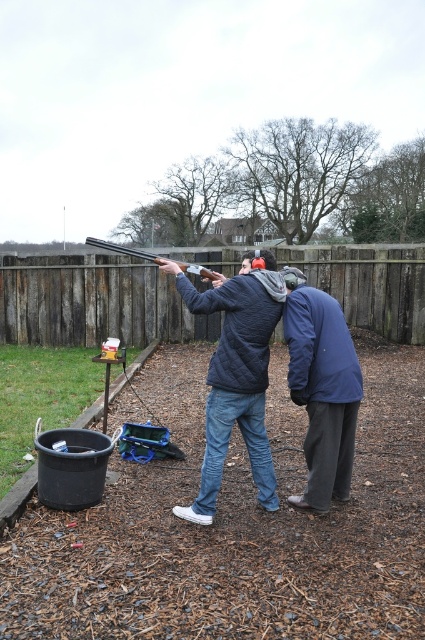
You are planning to set up a small tent between the brown wooden fence at upper center and the dark blue quilted jacket at center. Based on their relative widths, do you think the tent will fit horizontally between them?

The brown wooden fence at upper center might be wider than dark blue quilted jacket at center, so there might be enough space for the tent to fit horizontally between them.

You are a safety officer at the shooting range. You need to ensure that the dark blue fabric jacket at center and the matte black shotgun at center are positioned safely. Based on their sizes, which object is more likely to block the line of sight of someone approaching from the front?

The dark blue fabric jacket at center is taller than the matte black shotgun at center, so it is more likely to block the line of sight of someone approaching from the front.

You are a safety officer at the shooting range. You need to ensure that all participants maintain a minimum distance of 15 inches between each other for safety. Based on the image provided, is the distance between the dark blue quilted jacket at center and the dark blue fabric jacket at center sufficient?

The dark blue quilted jacket at center is 14.32 inches from the dark blue fabric jacket at center, which is less than the required 15 inches. Therefore, the distance is insufficient to meet safety standards.